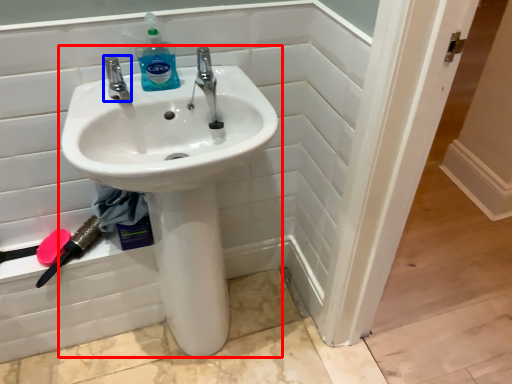
Question: Which object is closer to the camera taking this photo, sink (highlighted by a red box) or tap (highlighted by a blue box)?

Choices:
 (A) sink
 (B) tap

Answer: (A)